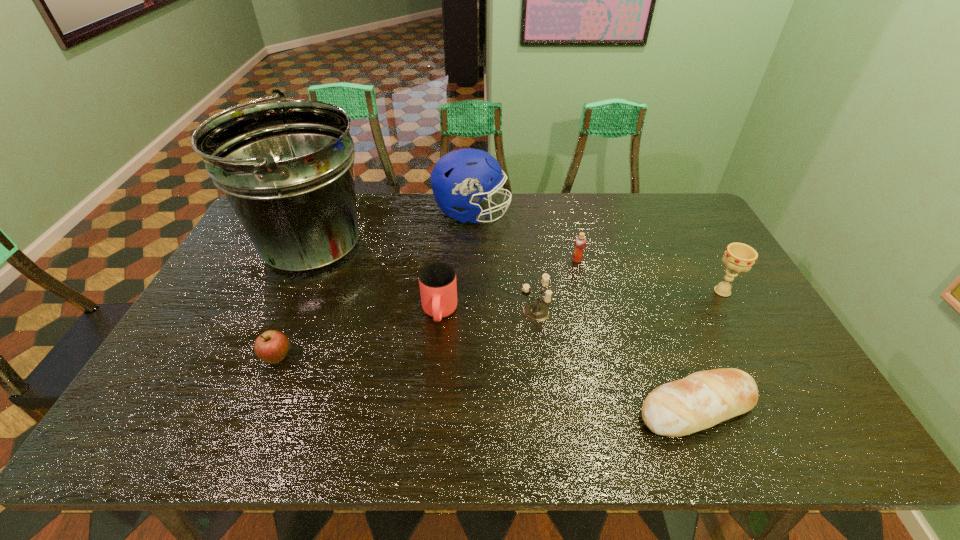
Where is `bucket`? The width and height of the screenshot is (960, 540). bucket is located at coordinates click(x=285, y=167).

Locate an element on the screen. The image size is (960, 540). the seventh shortest object is located at coordinates (458, 179).

Where is `the third tallest object`? Image resolution: width=960 pixels, height=540 pixels. the third tallest object is located at coordinates (739, 257).

Identify the location of the rightmost object. (739, 257).

Locate an element on the screen. This screenshot has height=540, width=960. cup is located at coordinates (438, 288).

Where is `candle holder`? candle holder is located at coordinates (538, 311).

Locate an element on the screen. Image resolution: width=960 pixels, height=540 pixels. orange juice is located at coordinates (580, 242).

Identify the location of the seventh farthest object. The image size is (960, 540). (272, 346).

Locate an element on the screen. This screenshot has width=960, height=540. the nearest object is located at coordinates (703, 399).

Find the location of `the seventh object from left to right`. the seventh object from left to right is located at coordinates (703, 399).